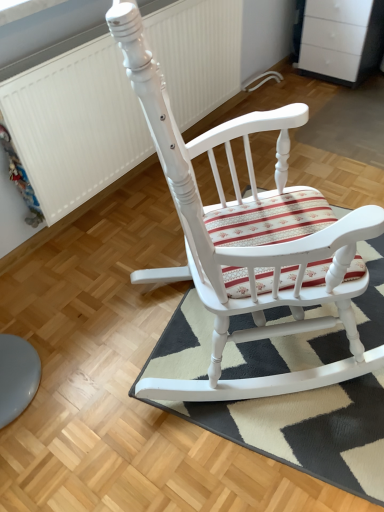
Question: Considering the relative positions of white textured radiator at upper left and white painted wood rocking chair at center in the image provided, is white textured radiator at upper left in front of white painted wood rocking chair at center?

Choices:
 (A) no
 (B) yes

Answer: (A)

Question: Does white textured radiator at upper left contain white painted wood rocking chair at center?

Choices:
 (A) yes
 (B) no

Answer: (B)

Question: Considering the relative sizes of white textured radiator at upper left and white painted wood rocking chair at center in the image provided, is white textured radiator at upper left taller than white painted wood rocking chair at center?

Choices:
 (A) no
 (B) yes

Answer: (A)

Question: Could you tell me if white textured radiator at upper left is turned towards white painted wood rocking chair at center?

Choices:
 (A) no
 (B) yes

Answer: (B)

Question: Is white textured radiator at upper left not within white painted wood rocking chair at center?

Choices:
 (A) no
 (B) yes

Answer: (B)

Question: From the image's perspective, is white painted wood rocking chair at center located above or below white textured radiator at upper left?

Choices:
 (A) above
 (B) below

Answer: (B)

Question: Is white painted wood rocking chair at center situated inside white textured radiator at upper left or outside?

Choices:
 (A) outside
 (B) inside

Answer: (A)

Question: From a real-world perspective, is white painted wood rocking chair at center positioned above or below white textured radiator at upper left?

Choices:
 (A) below
 (B) above

Answer: (B)

Question: Would you say white painted wood rocking chair at center is to the left or to the right of white textured radiator at upper left in the picture?

Choices:
 (A) right
 (B) left

Answer: (A)

Question: From the image's perspective, is white textured radiator at upper left located above or below striped fabric doormat at center?

Choices:
 (A) above
 (B) below

Answer: (A)

Question: Visually, is white textured radiator at upper left positioned to the left or to the right of striped fabric doormat at center?

Choices:
 (A) left
 (B) right

Answer: (A)

Question: Considering the positions of white textured radiator at upper left and striped fabric doormat at center in the image, is white textured radiator at upper left taller or shorter than striped fabric doormat at center?

Choices:
 (A) tall
 (B) short

Answer: (A)

Question: Considering the positions of white textured radiator at upper left and striped fabric doormat at center in the image, is white textured radiator at upper left wider or thinner than striped fabric doormat at center?

Choices:
 (A) wide
 (B) thin

Answer: (B)

Question: In terms of size, does striped fabric doormat at center appear bigger or smaller than white textured radiator at upper left?

Choices:
 (A) small
 (B) big

Answer: (A)

Question: Choose the correct answer: Is striped fabric doormat at center inside white textured radiator at upper left or outside it?

Choices:
 (A) outside
 (B) inside

Answer: (A)